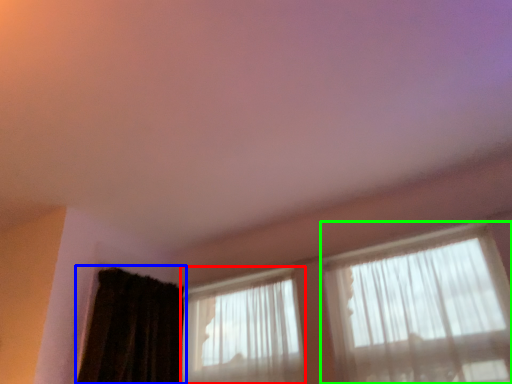
Question: Based on their relative distances, which object is nearer to window (highlighted by a red box)? Choose from curtain (highlighted by a blue box) and window (highlighted by a green box).

Choices:
 (A) curtain
 (B) window

Answer: (A)